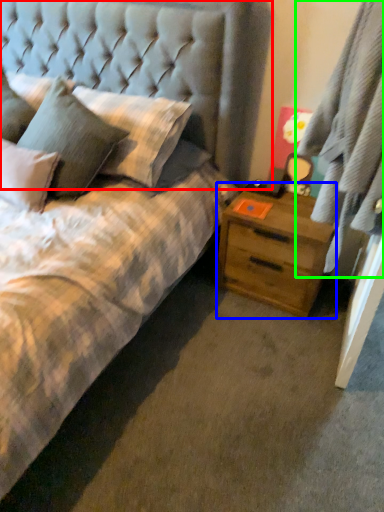
Question: Which object is the farthest from headboard (highlighted by a red box)? Choose among these: nightstand (highlighted by a blue box) or curtain (highlighted by a green box).

Choices:
 (A) nightstand
 (B) curtain

Answer: (B)